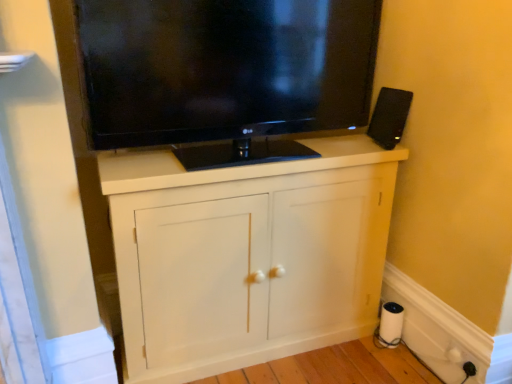
Locate an element on the screen. This screenshot has width=512, height=384. white matte cabinet at center is located at coordinates (247, 255).

Measure the distance between point (x=450, y=367) and camera.

5.60 feet.

Measure the distance between black glossy tv at upper center and camera.

black glossy tv at upper center and camera are 4.18 feet apart from each other.

What is the approximate width of black plastic speaker at upper right?

It is 7.01 inches.

What do you see at coordinates (389, 117) in the screenshot? I see `black plastic speaker at upper right` at bounding box center [389, 117].

This screenshot has height=384, width=512. What do you see at coordinates (454, 354) in the screenshot? I see `white plastic outlet at lower right, which is the 1th electric outlet from left to right` at bounding box center [454, 354].

Where is `white matte cabinet at center`? white matte cabinet at center is located at coordinates (247, 255).

From a real-world perspective, relative to white matte paper towel at lower right, is black plastic speaker at upper right vertically above or below?

black plastic speaker at upper right is situated higher than white matte paper towel at lower right in the real world.

Are black plastic speaker at upper right and white matte paper towel at lower right located far from each other?

No, black plastic speaker at upper right is not far away from white matte paper towel at lower right.

Between black plastic speaker at upper right and white matte paper towel at lower right, which one appears on the right side from the viewer's perspective?

white matte paper towel at lower right is more to the right.

How much distance is there between black plastic speaker at upper right and white matte paper towel at lower right?

32.48 inches.

From a real-world perspective, is white matte cabinet at center physically above white plastic outlet at lower right, acting as the 2th electric outlet starting from the right?

Correct, in the physical world, white matte cabinet at center is higher than white plastic outlet at lower right, acting as the 2th electric outlet starting from the right.

Considering the positions of objects white matte cabinet at center and white plastic outlet at lower right, acting as the 2th electric outlet starting from the right, in the image provided, who is behind, white matte cabinet at center or white plastic outlet at lower right, acting as the 2th electric outlet starting from the right,?

white plastic outlet at lower right, acting as the 2th electric outlet starting from the right.

From the image's perspective, relative to white plastic outlet at lower right, acting as the 2th electric outlet starting from the right, is white matte cabinet at center above or below?

From the image's perspective, white matte cabinet at center appears above white plastic outlet at lower right, acting as the 2th electric outlet starting from the right.

Starting from the black plastic speaker at upper right, which electric outlet is the 1st one to the right? Please provide its 2D coordinates.

[(454, 354)]

Is black plastic speaker at upper right facing towards white plastic outlet at lower right, acting as the 2th electric outlet starting from the right?

No, black plastic speaker at upper right does not turn towards white plastic outlet at lower right, acting as the 2th electric outlet starting from the right.

Does black plastic speaker at upper right have a larger size compared to white plastic outlet at lower right, which is the 1th electric outlet from left to right?

Yes.

In terms of size, does white matte cabinet at center appear bigger or smaller than black glossy tv at upper center?

In the image, white matte cabinet at center appears to be larger than black glossy tv at upper center.

Would you say white matte cabinet at center is outside black glossy tv at upper center?

Yes.

Consider the image. Can you confirm if white matte cabinet at center is shorter than black glossy tv at upper center?

No, white matte cabinet at center is not shorter than black glossy tv at upper center.

Which object is positioned more to the left, white matte cabinet at center or black glossy tv at upper center?

black glossy tv at upper center is more to the left.

This screenshot has width=512, height=384. What are the coordinates of `loudspeaker above the white matte cabinet at center (from a real-world perspective)` in the screenshot? It's located at (389, 117).

From a real-world perspective, who is located higher, black plastic speaker at upper right or white matte cabinet at center?

black plastic speaker at upper right, from a real-world perspective.

Does black plastic speaker at upper right appear on the right side of white matte cabinet at center?

Correct, you'll find black plastic speaker at upper right to the right of white matte cabinet at center.

From the picture: Which is further, (241,159) or (401,104)?

Point (241,159)

In the scene shown: From a real-world perspective, is black glossy tv at upper center positioned over black plastic speaker at upper right based on gravity?

Correct, in the physical world, black glossy tv at upper center is higher than black plastic speaker at upper right.

Based on the photo, from the image's perspective, would you say black glossy tv at upper center is shown under black plastic speaker at upper right?

No, from the image's perspective, black glossy tv at upper center is not below black plastic speaker at upper right.

Can you tell me how much black glossy tv at upper center and black plastic speaker at upper right differ in facing direction?

The facing directions of black glossy tv at upper center and black plastic speaker at upper right are 4.11 degrees apart.

Is the depth of white plastic outlet at lower right, acting as the 2th electric outlet starting from the right, greater than that of white matte paper towel at lower right?

No, it is not.

Which object is thinner, white plastic outlet at lower right, acting as the 2th electric outlet starting from the right, or white matte paper towel at lower right?

white plastic outlet at lower right, acting as the 2th electric outlet starting from the right.

From a real-world perspective, does white plastic outlet at lower right, acting as the 2th electric outlet starting from the right, sit lower than white matte paper towel at lower right?

No.

The width and height of the screenshot is (512, 384). There is a white matte paper towel at lower right. Find the location of `loudspeaker above it (from a real-world perspective)`. loudspeaker above it (from a real-world perspective) is located at coordinates (389, 117).

Find the location of a particular element. The width and height of the screenshot is (512, 384). the 2nd electric outlet directly beneath the white matte cabinet at center (from a real-world perspective) is located at coordinates (454, 354).

Considering their positions, is black plastic speaker at upper right positioned further to white plastic outlet at lower right, which is the 1th electric outlet from left to right, than white matte cabinet at center?

black plastic speaker at upper right lies further to white plastic outlet at lower right, which is the 1th electric outlet from left to right, than the other object.

When comparing their distances from white plastic outlet at lower right, which is the 1th electric outlet from left to right, does white matte cabinet at center or black plastic speaker at upper right seem further?

black plastic speaker at upper right lies further to white plastic outlet at lower right, which is the 1th electric outlet from left to right, than the other object.

Which object lies nearer to the anchor point white matte paper towel at lower right, black plastic speaker at upper right or white matte cabinet at center?

white matte cabinet at center is positioned closer to the anchor white matte paper towel at lower right.

When comparing their distances from white matte paper towel at lower right, does white plastic outlet at lower right, acting as the 2th electric outlet starting from the right, or black glossy tv at upper center seem closer?

white plastic outlet at lower right, acting as the 2th electric outlet starting from the right.

From the image, which object appears to be nearer to white matte paper towel at lower right, white plastic outlet at lower right, acting as the 2th electric outlet starting from the right, or white matte cabinet at center?

white plastic outlet at lower right, acting as the 2th electric outlet starting from the right.

Estimate the real-world distances between objects in this image. Which object is closer to black glossy tv at upper center, white plastic electric outlet at lower right, the 2th electric outlet when ordered from left to right, or white plastic outlet at lower right, acting as the 2th electric outlet starting from the right?

Among the two, white plastic electric outlet at lower right, the 2th electric outlet when ordered from left to right, is located nearer to black glossy tv at upper center.

Looking at the image, which one is located closer to white matte cabinet at center, white matte paper towel at lower right or black plastic speaker at upper right?

white matte paper towel at lower right lies closer to white matte cabinet at center than the other object.

From the image, which object appears to be farther from black glossy tv at upper center, black plastic speaker at upper right or white plastic electric outlet at lower right, which is the 1th electric outlet in right-to-left order?

Based on the image, white plastic electric outlet at lower right, which is the 1th electric outlet in right-to-left order, appears to be further to black glossy tv at upper center.

Where is `electric outlet between black glossy tv at upper center and white plastic electric outlet at lower right, the 2th electric outlet when ordered from left to right, in the vertical direction`? The height and width of the screenshot is (384, 512). electric outlet between black glossy tv at upper center and white plastic electric outlet at lower right, the 2th electric outlet when ordered from left to right, in the vertical direction is located at coordinates (454, 354).

At what (x,y) coordinates should I click in order to perform the action: click on electric outlet between black plastic speaker at upper right and white plastic electric outlet at lower right, which is the 1th electric outlet in right-to-left order, from top to bottom. Please return your answer as a coordinate pair (x, y). Looking at the image, I should click on (454, 354).

Find the location of a particular element. cabinetry between black glossy tv at upper center and white matte paper towel at lower right in the vertical direction is located at coordinates (247, 255).

Find the location of a particular element. cabinetry between black glossy tv at upper center and white plastic electric outlet at lower right, the 2th electric outlet when ordered from left to right, vertically is located at coordinates (247, 255).